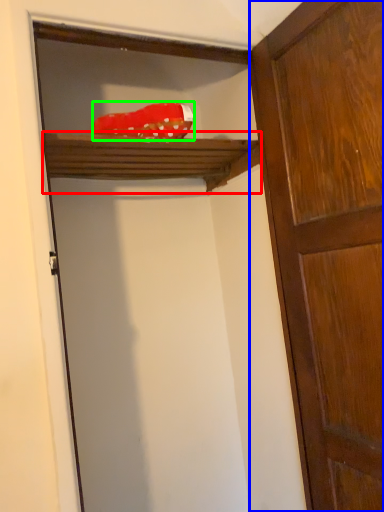
Question: Based on their relative distances, which object is nearer to shelf (highlighted by a red box)? Choose from door (highlighted by a blue box) and material (highlighted by a green box).

Choices:
 (A) door
 (B) material

Answer: (B)